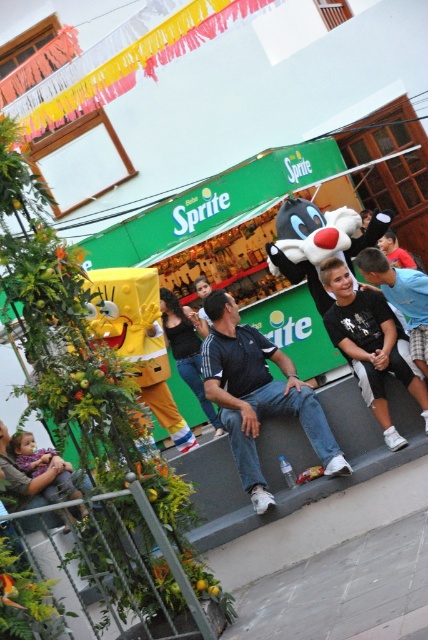
Is dark blue shirt at center below black matte skateboard at center?

Indeed, dark blue shirt at center is positioned under black matte skateboard at center.

Consider the image. Which is more to the left, dark blue shirt at center or black matte skateboard at center?

Positioned to the left is dark blue shirt at center.

This screenshot has height=640, width=428. What do you see at coordinates (258, 394) in the screenshot?
I see `dark blue shirt at center` at bounding box center [258, 394].

Locate an element on the screen. dark blue shirt at center is located at coordinates (258, 394).

Does black matte skateboard at center have a lesser width compared to plush purple dress at lower left?

Indeed, black matte skateboard at center has a lesser width compared to plush purple dress at lower left.

What do you see at coordinates (371, 346) in the screenshot?
I see `black matte skateboard at center` at bounding box center [371, 346].

Is point (354, 353) more distant than point (71, 465)?

No, it is in front of (71, 465).

The width and height of the screenshot is (428, 640). I want to click on black matte skateboard at center, so click(x=371, y=346).

Does dark blue shirt at center have a lesser height compared to plush purple dress at lower left?

No.

Describe the element at coordinates (258, 394) in the screenshot. I see `dark blue shirt at center` at that location.

I want to click on dark blue shirt at center, so click(258, 394).